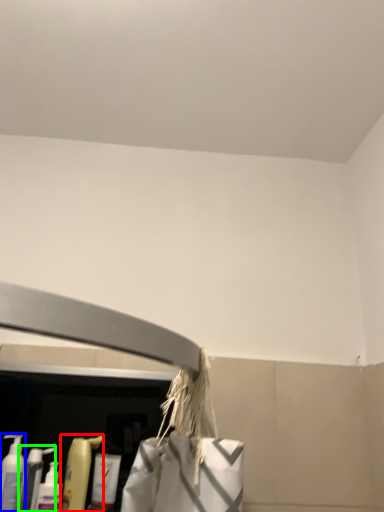
Question: Which object is positioned farthest from cleaning product (highlighted by a red box)? Select from cleaning product (highlighted by a blue box) and cleaning product (highlighted by a green box).

Choices:
 (A) cleaning product
 (B) cleaning product

Answer: (A)